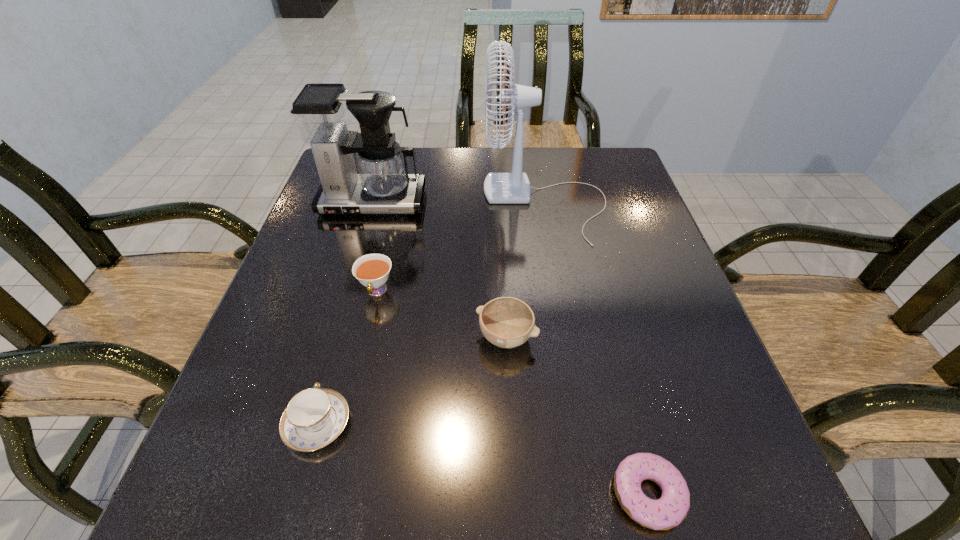
This screenshot has height=540, width=960. In order to click on vacant area that lies between the doughnut and the third nearest object in this screenshot , I will do `click(577, 415)`.

In order to click on empty space between the farther teacup and the coffee maker in this screenshot , I will do `click(374, 247)`.

I want to click on empty space that is in between the bowl and the nearest object, so click(577, 415).

Locate an element on the screen. The height and width of the screenshot is (540, 960). vacant space in between the fifth shortest object and the nearer teacup is located at coordinates (345, 313).

Where is `vacant area that lies between the third nearest object and the coffee maker`? The height and width of the screenshot is (540, 960). vacant area that lies between the third nearest object and the coffee maker is located at coordinates (440, 270).

Where is `object that is the third nearest to the fifth shortest object`? The height and width of the screenshot is (540, 960). object that is the third nearest to the fifth shortest object is located at coordinates (507, 322).

This screenshot has width=960, height=540. What are the coordinates of `the third closest object to the fan` in the screenshot? It's located at (372, 270).

Locate an element on the screen. Image resolution: width=960 pixels, height=540 pixels. free region that satisfies the following two spatial constraints: 1. on the side of the third farthest object with the handle; 2. on the right side of the nearest object is located at coordinates (331, 494).

Identify the location of vacant position in the image that satisfies the following two spatial constraints: 1. at the front of the doughnut where the controls are located; 2. on the right side of the coffee maker. (287, 494).

Identify the location of free space in the image that satisfies the following two spatial constraints: 1. on the side of the fourth nearest object with the handle; 2. on the left side of the shortest object. (331, 494).